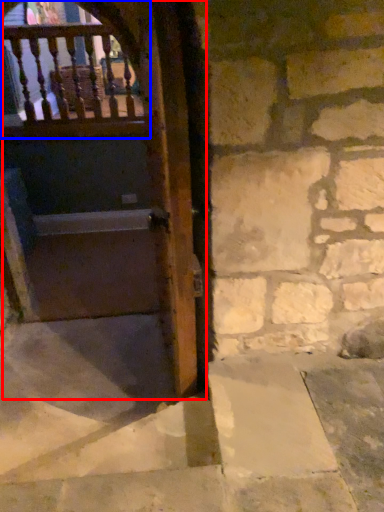
Question: Which object appears farthest to the camera in this image, door (highlighted by a red box) or balcony (highlighted by a blue box)?

Choices:
 (A) door
 (B) balcony

Answer: (B)